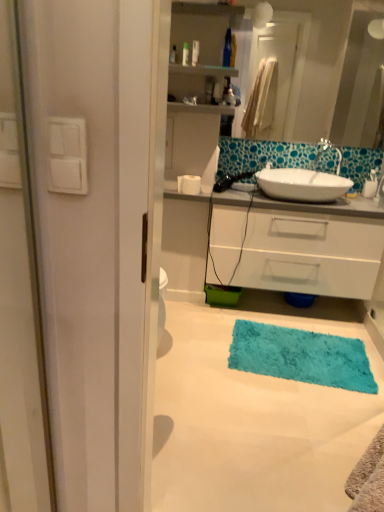
Question: Is turquoise shaggy rug at lower center positioned far away from turquoise shaggy bath mat at lower center?

Choices:
 (A) no
 (B) yes

Answer: (A)

Question: From the image's perspective, does turquoise shaggy rug at lower center appear higher than turquoise shaggy bath mat at lower center?

Choices:
 (A) no
 (B) yes

Answer: (A)

Question: Is turquoise shaggy rug at lower center facing away from turquoise shaggy bath mat at lower center?

Choices:
 (A) no
 (B) yes

Answer: (A)

Question: Does turquoise shaggy rug at lower center have a larger size compared to turquoise shaggy bath mat at lower center?

Choices:
 (A) no
 (B) yes

Answer: (B)

Question: Is turquoise shaggy rug at lower center oriented towards turquoise shaggy bath mat at lower center?

Choices:
 (A) yes
 (B) no

Answer: (A)

Question: From the image's perspective, relative to white glossy mirror at upper center, is turquoise shaggy bath mat at lower center above or below?

Choices:
 (A) above
 (B) below

Answer: (B)

Question: Is turquoise shaggy bath mat at lower center taller or shorter than white glossy mirror at upper center?

Choices:
 (A) tall
 (B) short

Answer: (B)

Question: From a real-world perspective, is turquoise shaggy bath mat at lower center above or below white glossy mirror at upper center?

Choices:
 (A) below
 (B) above

Answer: (A)

Question: Is turquoise shaggy bath mat at lower center to the left or to the right of white glossy mirror at upper center in the image?

Choices:
 (A) left
 (B) right

Answer: (A)

Question: Does point (294, 76) appear closer or farther from the camera than point (273, 451)?

Choices:
 (A) farther
 (B) closer

Answer: (A)

Question: In terms of width, does white glossy mirror at upper center look wider or thinner when compared to turquoise shaggy rug at lower center?

Choices:
 (A) thin
 (B) wide

Answer: (A)

Question: Is white glossy mirror at upper center taller or shorter than turquoise shaggy rug at lower center?

Choices:
 (A) short
 (B) tall

Answer: (B)

Question: Is white glossy mirror at upper center bigger or smaller than turquoise shaggy rug at lower center?

Choices:
 (A) small
 (B) big

Answer: (A)

Question: Considering the positions of translucent plastic bottle at upper center and white glossy mirror at upper center in the image, is translucent plastic bottle at upper center bigger or smaller than white glossy mirror at upper center?

Choices:
 (A) small
 (B) big

Answer: (A)

Question: Is translucent plastic bottle at upper center taller or shorter than white glossy mirror at upper center?

Choices:
 (A) short
 (B) tall

Answer: (A)